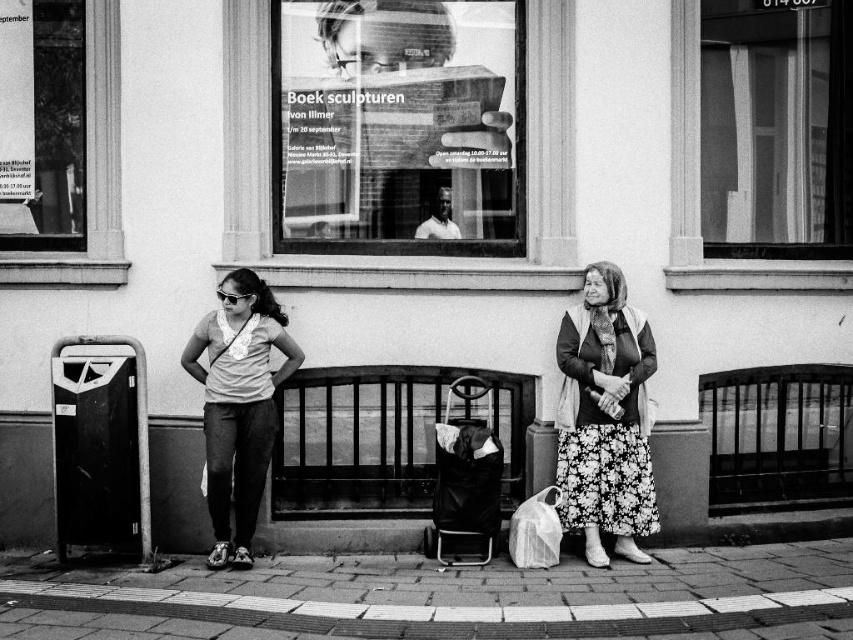
Question: Among these points, which one is farthest from the camera?

Choices:
 (A) (625, 308)
 (B) (521, 541)
 (C) (210, 458)

Answer: (A)

Question: Can you confirm if brick pavement at lower center is positioned above floral skirt at center?

Choices:
 (A) no
 (B) yes

Answer: (A)

Question: Is the position of floral skirt at center more distant than that of translucent plastic bag at lower center?

Choices:
 (A) no
 (B) yes

Answer: (B)

Question: Which object appears closest to the camera in this image?

Choices:
 (A) translucent plastic bag at lower center
 (B) floral skirt at center

Answer: (A)

Question: Which point is closer to the camera?

Choices:
 (A) brick pavement at lower center
 (B) floral skirt at center
 (C) matte gray shirt at center
 (D) translucent plastic bag at lower center

Answer: (A)

Question: Can you confirm if brick pavement at lower center is thinner than translucent plastic bag at lower center?

Choices:
 (A) no
 (B) yes

Answer: (A)